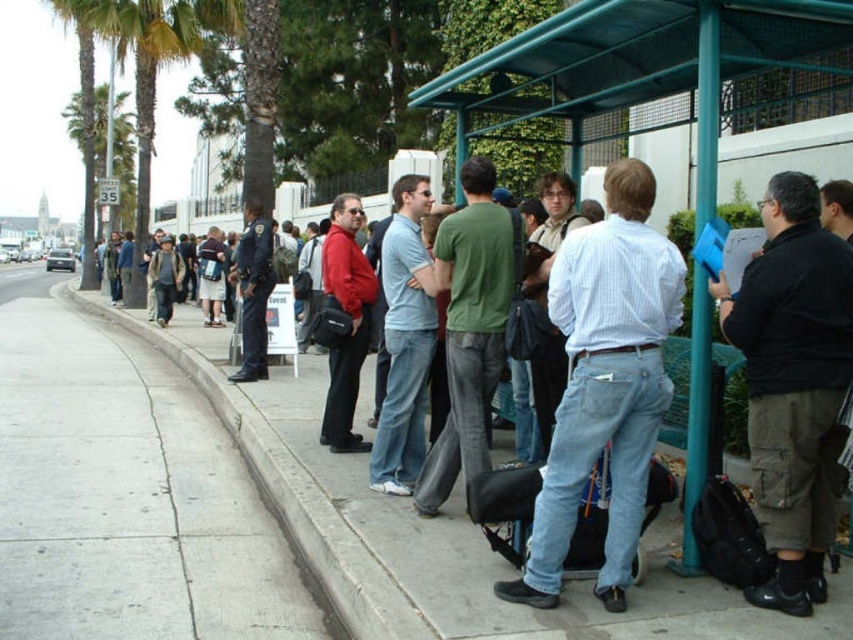
Question: Among these points, which one is farthest from the camera?

Choices:
 (A) (254, 243)
 (B) (349, 352)

Answer: (A)

Question: Which object appears closest to the camera in this image?

Choices:
 (A) green metal bus stop at center
 (B) light blue denim jeans at center
 (C) denim jacket at left
 (D) matte black backpack at center

Answer: (D)

Question: Does light blue denim jeans at center have a greater width compared to matte red jacket at center?

Choices:
 (A) no
 (B) yes

Answer: (B)

Question: Does light blue denim jeans at center appear under denim jacket at left?

Choices:
 (A) no
 (B) yes

Answer: (B)

Question: In this image, where is green metal bus stop at center located relative to dark blue uniform at center?

Choices:
 (A) left
 (B) right

Answer: (B)

Question: Which of the following is the farthest from the observer?

Choices:
 (A) denim jeans at center
 (B) denim jacket at left
 (C) matte black backpack at center
 (D) black cotton shirt at right

Answer: (B)